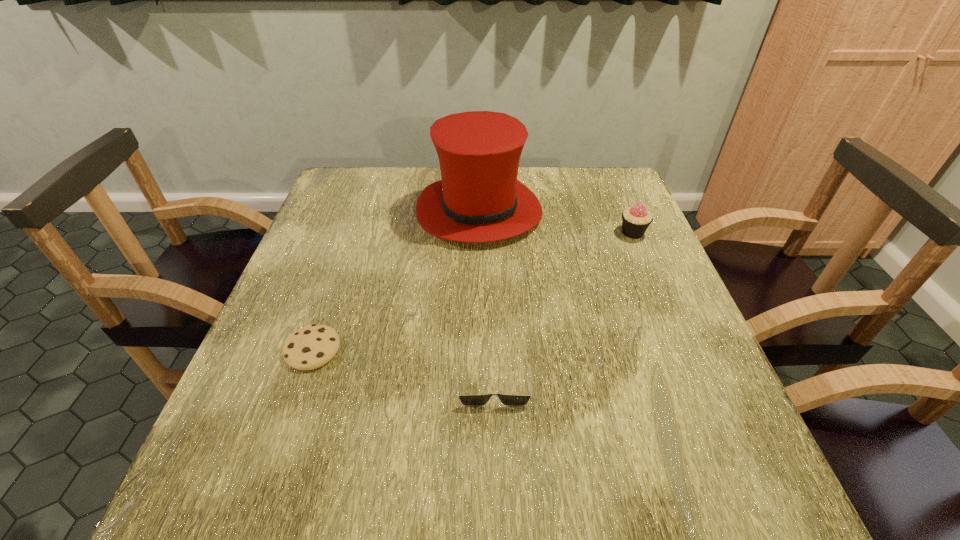
At what (x,y) coordinates should I click in order to perform the action: click on the tallest object. Please return your answer as a coordinate pair (x, y). The height and width of the screenshot is (540, 960). Looking at the image, I should click on (479, 199).

This screenshot has width=960, height=540. Identify the location of cupcake. (635, 220).

In order to click on the second tallest object in this screenshot , I will do `click(635, 220)`.

This screenshot has height=540, width=960. What are the coordinates of `sunglasses` in the screenshot? It's located at (467, 400).

This screenshot has height=540, width=960. I want to click on the leftmost object, so click(x=310, y=347).

The image size is (960, 540). Identify the location of vacant region located on the right of the hat. (589, 212).

Identify the location of free location located on the left of the second tallest object. (491, 233).

Image resolution: width=960 pixels, height=540 pixels. What are the coordinates of `free space located 0.170m on the front-facing side of the sunglasses` in the screenshot? It's located at (497, 509).

In order to click on free region located 0.100m on the front of the cookie in this screenshot , I will do `click(288, 422)`.

Where is `object situated at the far edge`? The height and width of the screenshot is (540, 960). object situated at the far edge is located at coordinates (479, 199).